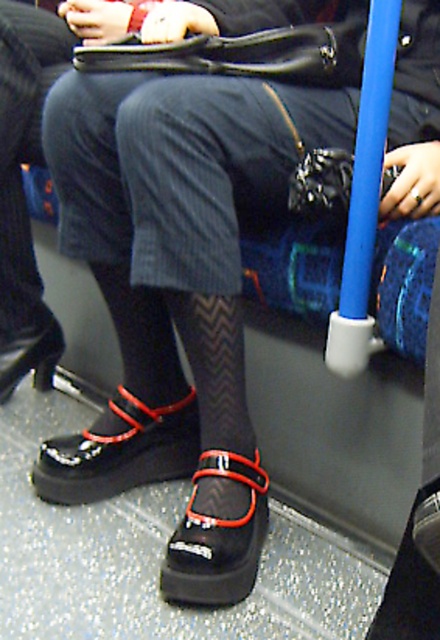
You are a passenger on a train and see the black mesh tights at lower center and the black leather shoe at lower left. Which object is located to the right in the image?

The black mesh tights at lower center is positioned on the right side of the black leather shoe at lower left, so the black mesh tights at lower center is located to the right.

You are a passenger on a train and want to make sure your belongings are secure. You have a small bag that needs to be placed between you and the black suede mary jane shoes at lower center. The bag requires 2 feet of space. Is there enough space between you and the shoes?

The distance between you and the black suede mary jane shoes at lower center is 3.58 feet. Since the required space is 2 feet, there is enough space to place the bag between you and the shoes.

You are sitting on the blue seat in the image and want to place a small object on the floor beneath your feet. The floor is metallic and reflective. There are two points marked on the floor at coordinates point (29, 273) and point (22, 371). Which point is closer to you so that you can easily reach it without moving your legs?

Point (29, 273) is closer to the viewer than point (22, 371), so you can easily reach it without moving your legs.